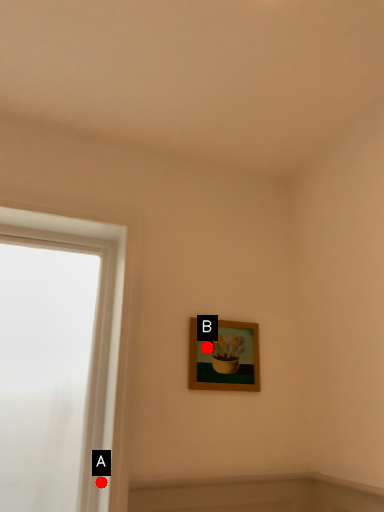
Question: Two points are circled on the image, labeled by A and B beside each circle. Among these points, which one is nearest to the camera?

Choices:
 (A) A is closer
 (B) B is closer

Answer: (A)